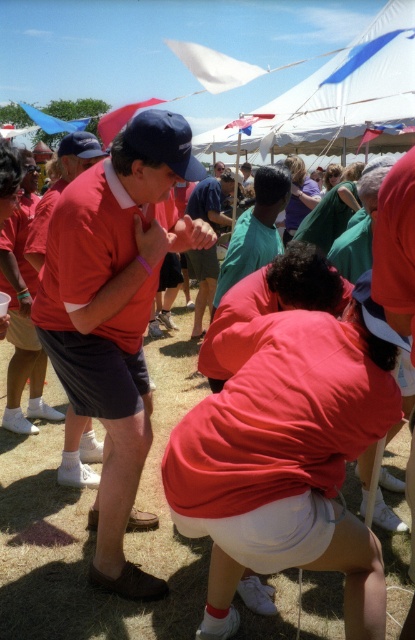
Question: Can you confirm if teal fabric shirt at center is smaller than green cotton shirt at center?

Choices:
 (A) no
 (B) yes

Answer: (A)

Question: Can you confirm if matte red shirt at left is positioned to the right of green cotton shirt at center?

Choices:
 (A) yes
 (B) no

Answer: (B)

Question: Among these points, which one is nearest to the camera?

Choices:
 (A) (261, 230)
 (B) (207, 296)
 (C) (222, 534)
 (D) (102, 522)

Answer: (C)

Question: Does matte red shirt at center have a smaller size compared to teal fabric shirt at center?

Choices:
 (A) no
 (B) yes

Answer: (B)

Question: Which object is positioned farthest from the green cotton shirt at center?

Choices:
 (A) teal fabric shirt at center
 (B) matte red shirt at center

Answer: (B)

Question: Which object appears closest to the camera in this image?

Choices:
 (A) matte red shirt at left
 (B) matte red shirt at center

Answer: (B)